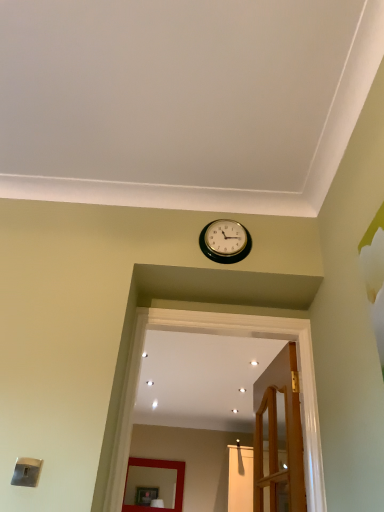
The image size is (384, 512). Identify the location of matte red mirror at center. (158, 467).

Image resolution: width=384 pixels, height=512 pixels. What are the coordinates of `glass door in front of the matte red mirror at center` in the screenshot? It's located at (240, 478).

Is transparent glass door at lower center turned away from matte red mirror at center?

transparent glass door at lower center does not have its back to matte red mirror at center.

From the image's perspective, is transparent glass door at lower center located above or below matte red mirror at center?

Clearly, from the image's perspective, transparent glass door at lower center is above matte red mirror at center.

Looking at their sizes, would you say transparent glass door at lower center is wider or thinner than matte red mirror at center?

In the image, transparent glass door at lower center appears to be wider than matte red mirror at center.

Considering the sizes of objects wooden door at center and gold metallic wall clock at upper center in the image provided, who is smaller, wooden door at center or gold metallic wall clock at upper center?

gold metallic wall clock at upper center is smaller.

From the image's perspective, which one is positioned lower, wooden door at center or gold metallic wall clock at upper center?

wooden door at center appears lower in the image.

Between wooden door at center and gold metallic wall clock at upper center, which one has more height?

wooden door at center.

Can you tell me how much wooden door at center and gold metallic wall clock at upper center differ in facing direction?

There is a 83.6-degree angle between the facing directions of wooden door at center and gold metallic wall clock at upper center.

From the image's perspective, is transparent glass door at lower center positioned above or below wooden door at center?

transparent glass door at lower center is below wooden door at center.

Is transparent glass door at lower center taller or shorter than wooden door at center?

transparent glass door at lower center is taller than wooden door at center.

Considering the points (238, 499) and (296, 508), which point is in front, point (238, 499) or point (296, 508)?

The point (296, 508) is in front.

Based on the photo, which is correct: transparent glass door at lower center is inside wooden door at center, or outside of it?

transparent glass door at lower center is spatially situated outside wooden door at center.

Would you consider wooden door at center to be distant from transparent glass door at lower center?

Yes, wooden door at center and transparent glass door at lower center are located far from each other.

From the image's perspective, is wooden door at center located beneath transparent glass door at lower center?

No, from the image's perspective, wooden door at center is not below transparent glass door at lower center.

How far apart are wooden door at center and transparent glass door at lower center?

wooden door at center and transparent glass door at lower center are 4.27 meters apart from each other.

What's the angular difference between wooden door at center and transparent glass door at lower center's facing directions?

The angle between the facing direction of wooden door at center and the facing direction of transparent glass door at lower center is 78 degrees.

Based on the photo, does transparent glass door at lower center turn towards gold metallic wall clock at upper center?

Yes, transparent glass door at lower center is oriented towards gold metallic wall clock at upper center.

In the image, is transparent glass door at lower center positioned in front of or behind gold metallic wall clock at upper center?

In the image, transparent glass door at lower center appears behind gold metallic wall clock at upper center.

Considering the sizes of objects transparent glass door at lower center and gold metallic wall clock at upper center in the image provided, who is taller, transparent glass door at lower center or gold metallic wall clock at upper center?

transparent glass door at lower center.

Does transparent glass door at lower center appear on the left side of gold metallic wall clock at upper center?

No.

Which object is further away from the camera, gold metallic wall clock at upper center or wooden door at center?

gold metallic wall clock at upper center.

Are gold metallic wall clock at upper center and wooden door at center far apart?

That's not correct — gold metallic wall clock at upper center is a little close to wooden door at center.

From a real-world perspective, which is physically above, gold metallic wall clock at upper center or wooden door at center?

In real-world perspective, gold metallic wall clock at upper center is above.

Which of these two, gold metallic wall clock at upper center or matte red mirror at center, is wider?

With larger width is matte red mirror at center.

Where is `mirror located below the gold metallic wall clock at upper center (from the image's perspective)`? The image size is (384, 512). mirror located below the gold metallic wall clock at upper center (from the image's perspective) is located at coordinates [158, 467].

Between gold metallic wall clock at upper center and matte red mirror at center, which one has smaller size?

gold metallic wall clock at upper center is smaller.

Is gold metallic wall clock at upper center far from matte red mirror at center?

Indeed, gold metallic wall clock at upper center is not near matte red mirror at center.

Identify the location of glass door lying in front of the matte red mirror at center. This screenshot has width=384, height=512. (240, 478).

Identify the location of wall clock behind the wooden door at center. (225, 241).

Which object lies nearer to the anchor point gold metallic wall clock at upper center, wooden door at center or transparent glass door at lower center?

The object closer to gold metallic wall clock at upper center is wooden door at center.

Estimate the real-world distances between objects in this image. Which object is closer to wooden door at center, matte red mirror at center or gold metallic wall clock at upper center?

gold metallic wall clock at upper center.

When comparing their distances from wooden door at center, does matte red mirror at center or transparent glass door at lower center seem further?

Among the two, matte red mirror at center is located further to wooden door at center.

Looking at the image, which one is located closer to wooden door at center, transparent glass door at lower center or matte red mirror at center?

transparent glass door at lower center is closer to wooden door at center.

From the image, which object appears to be nearer to wooden door at center, gold metallic wall clock at upper center or matte red mirror at center?

gold metallic wall clock at upper center is positioned closer to the anchor wooden door at center.

Looking at the image, which one is located closer to transparent glass door at lower center, wooden door at center or matte red mirror at center?

The object closer to transparent glass door at lower center is matte red mirror at center.

Estimate the real-world distances between objects in this image. Which object is closer to transparent glass door at lower center, gold metallic wall clock at upper center or matte red mirror at center?

matte red mirror at center lies closer to transparent glass door at lower center than the other object.

When comparing their distances from matte red mirror at center, does wooden door at center or gold metallic wall clock at upper center seem closer?

wooden door at center is positioned closer to the anchor matte red mirror at center.

I want to click on wall clock between wooden door at center and transparent glass door at lower center in the front-back direction, so click(x=225, y=241).

At what (x,y) coordinates should I click in order to perform the action: click on glass door between gold metallic wall clock at upper center and matte red mirror at center in the front-back direction. Please return your answer as a coordinate pair (x, y). This screenshot has width=384, height=512. Looking at the image, I should click on (240, 478).

This screenshot has height=512, width=384. I want to click on wall clock between wooden door at center and matte red mirror at center from front to back, so click(225, 241).

The height and width of the screenshot is (512, 384). I want to click on glass door between wooden door at center and matte red mirror at center from front to back, so click(x=240, y=478).